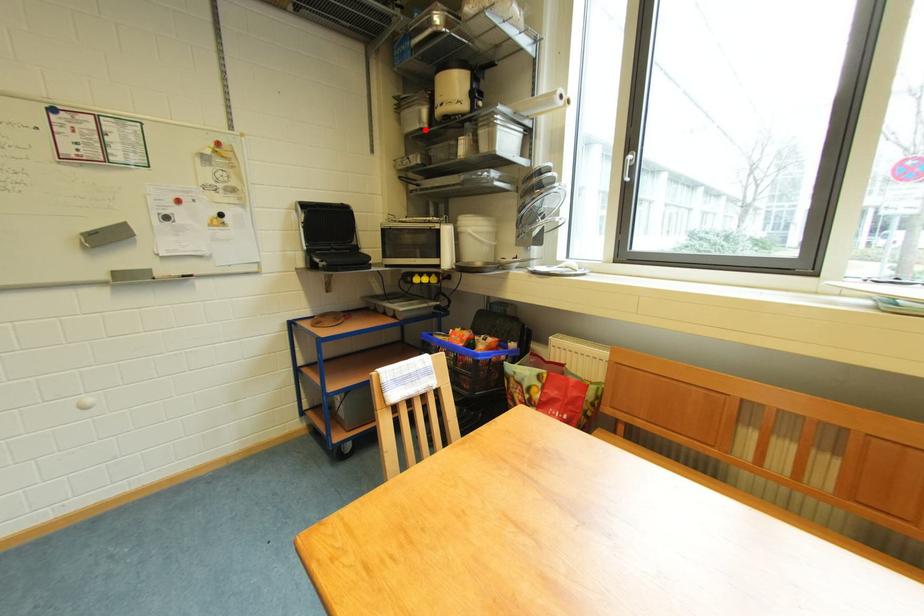
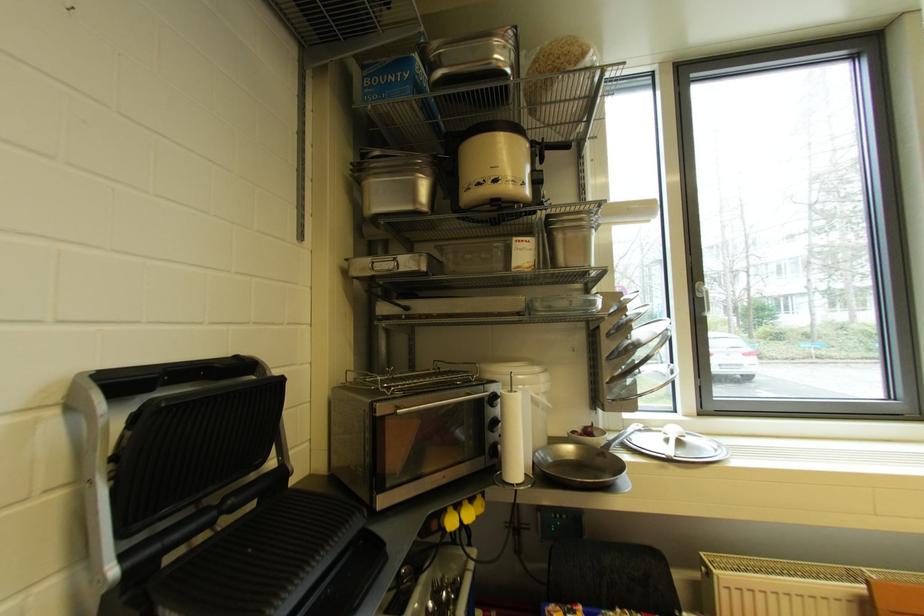
In the second image, find the point that corresponds to the highlighted location in the first image.

(418, 211)